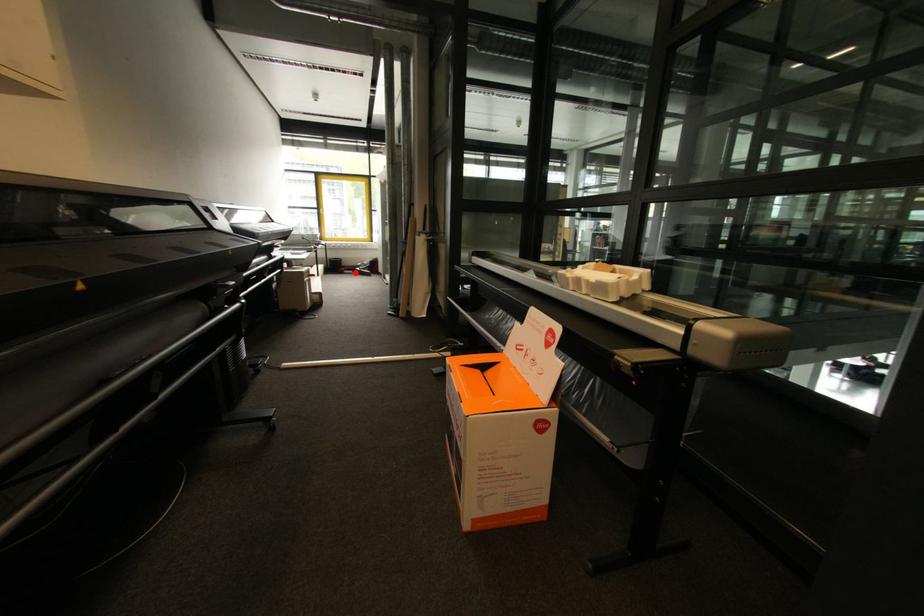
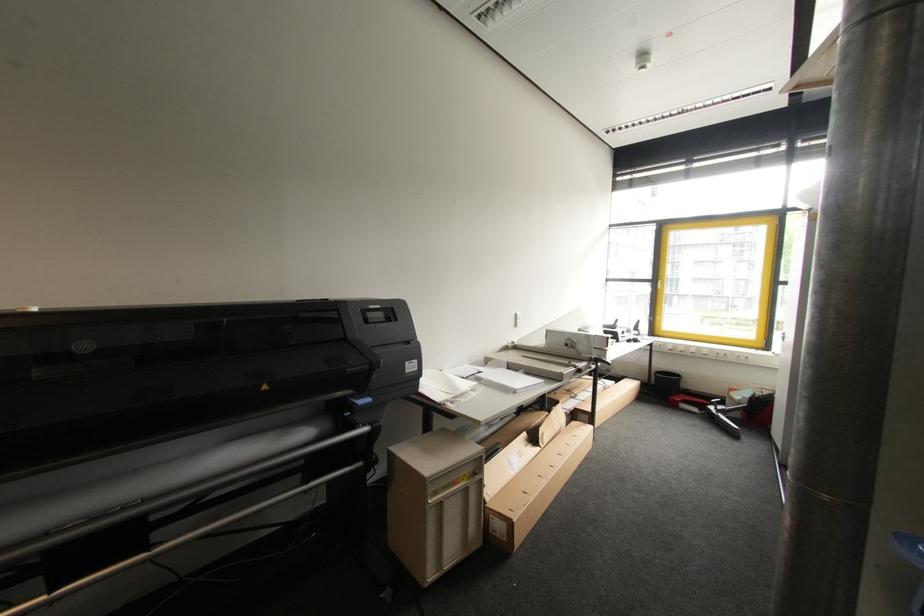
Locate, in the second image, the point that corresponds to the highlighted location in the first image.

(699, 411)